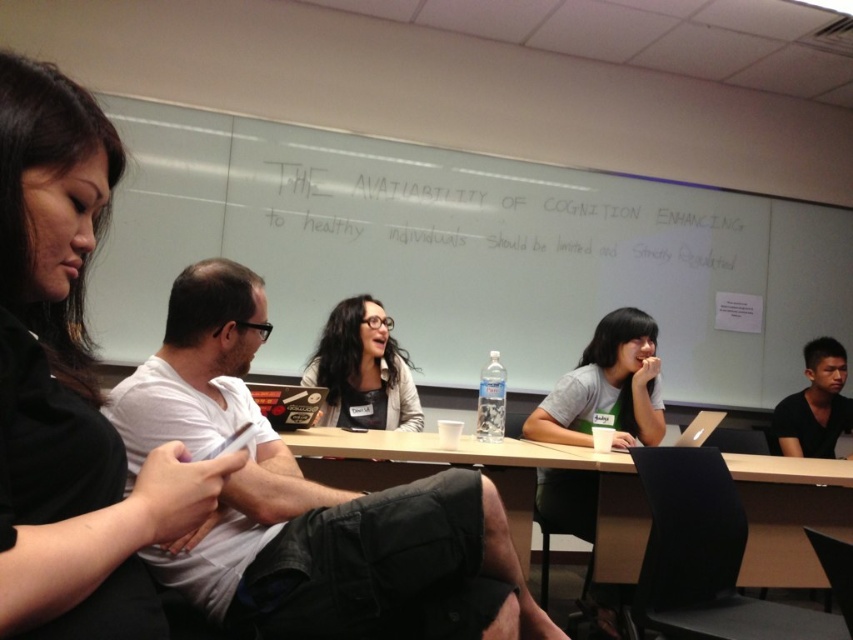
Question: Is gray matte shirt at center thinner than matte black jacket at center?

Choices:
 (A) yes
 (B) no

Answer: (B)

Question: Which of the following is the farthest from the observer?

Choices:
 (A) (503, 410)
 (B) (778, 579)

Answer: (B)

Question: Which is farther from the white cotton shirt at center?

Choices:
 (A) brown wooden table at center
 (B) whiteboard at upper center
 (C) matte black jacket at center
 (D) black matte shirt at right

Answer: (D)

Question: Among these objects, which one is nearest to the camera?

Choices:
 (A) black matte shirt at right
 (B) black matte shirt at upper left
 (C) matte black jacket at center
 (D) gray matte shirt at center

Answer: (B)

Question: Does white cotton shirt at center have a greater width compared to black matte shirt at right?

Choices:
 (A) no
 (B) yes

Answer: (B)

Question: Is whiteboard at upper center smaller than clear plastic water bottle at center?

Choices:
 (A) yes
 (B) no

Answer: (B)